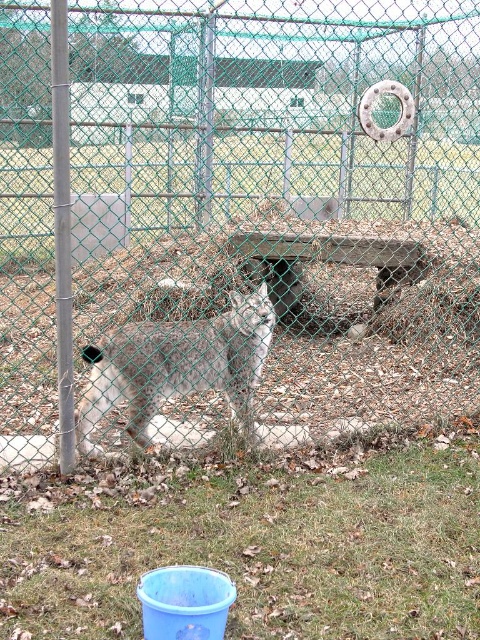
Is point (149, 356) behind point (158, 339)?

No.

The width and height of the screenshot is (480, 640). Find the location of `green mesh fence at center`. green mesh fence at center is located at coordinates (235, 220).